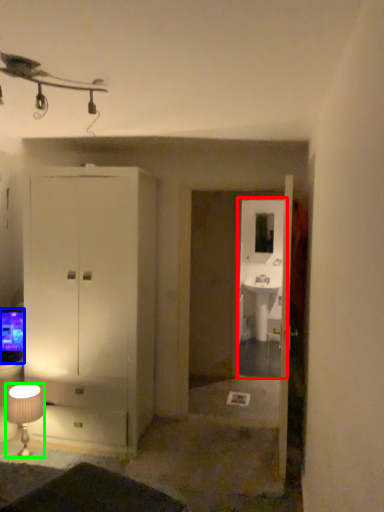
Question: Which object is the farthest from glass door (highlighted by a red box)? Choose among these: television (highlighted by a blue box) or lamp (highlighted by a green box).

Choices:
 (A) television
 (B) lamp

Answer: (B)